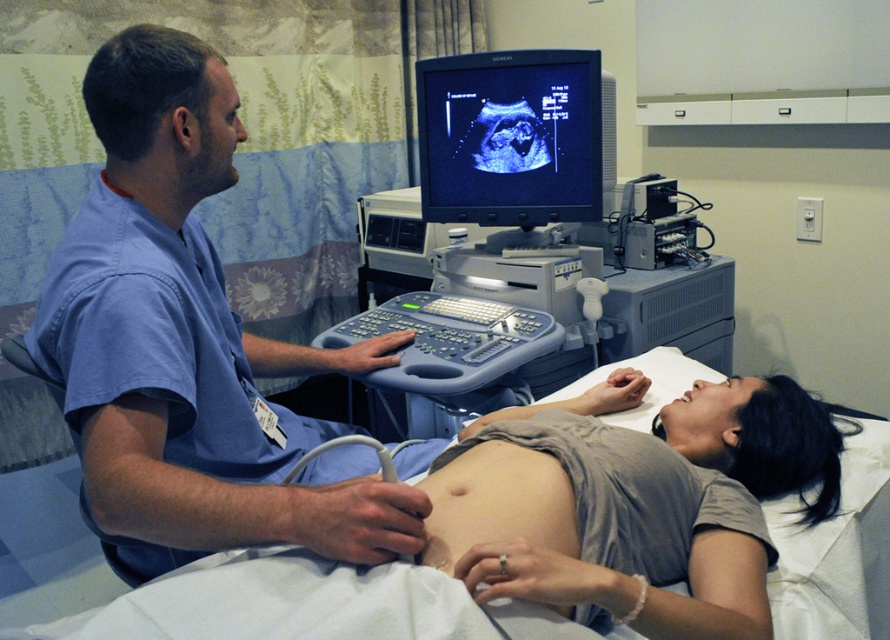
You are a medical student observing an ultrasound examination. You notice the gray plastic ultrasound machine at center and the smooth skin at center. Which object is closer to you, the observer?

The gray plastic ultrasound machine at center is closer to you than the smooth skin at center because the smooth skin at center is behind the gray plastic ultrasound machine at center.

You are a medical student observing an ultrasound examination. The scene includes a white fabric hospital bed at center and a black glossy monitor at upper center. Which object is taller?

The black glossy monitor at upper center is taller than the white fabric hospital bed at center.

You are a medical student observing an ultrasound examination. The scene includes a male medical professional in blue scrubs at center and a gray plastic ultrasound machine at center. Which object is taller?

The blue scrubs at center has a greater height compared to the gray plastic ultrasound machine at center.